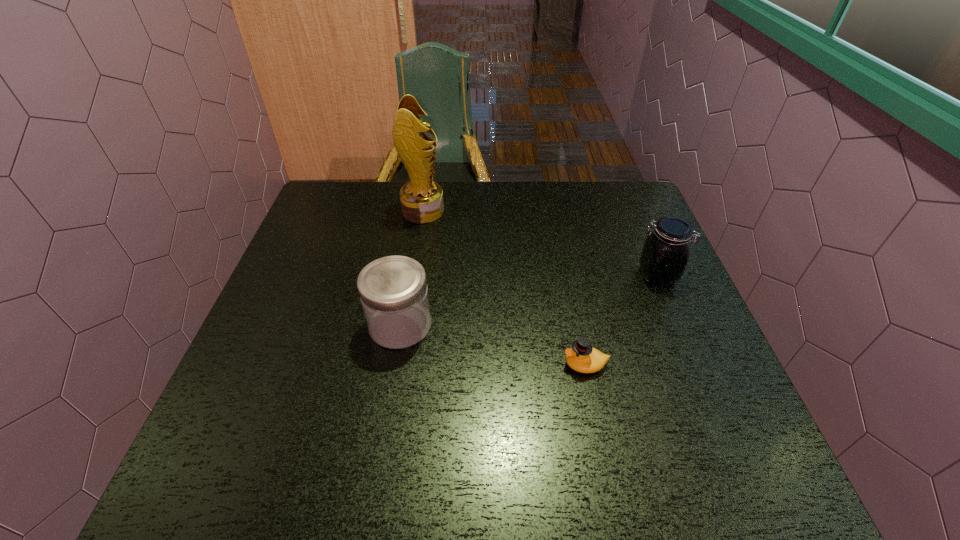
Identify the location of free region located on the lid of the second farthest object. (593, 275).

The height and width of the screenshot is (540, 960). In order to click on free spot located 0.290m on the lid of the second farthest object in this screenshot , I will do `click(524, 275)`.

Find the location of `vacant space located on the left of the left jar`. vacant space located on the left of the left jar is located at coordinates (330, 325).

The width and height of the screenshot is (960, 540). Identify the location of free space located 0.240m on the front-facing side of the second object from right to left. (451, 364).

Locate an element on the screen. vacant space positioned on the front-facing side of the second object from right to left is located at coordinates (497, 364).

What are the coordinates of `free point located 0.120m on the front-facing side of the second object from right to left` in the screenshot? It's located at (507, 364).

At what (x,y) coordinates should I click in order to perform the action: click on object that is positioned at the far edge. Please return your answer as a coordinate pair (x, y). Looking at the image, I should click on (421, 198).

At what (x,y) coordinates should I click in order to perform the action: click on object located in the right edge section of the desktop. Please return your answer as a coordinate pair (x, y). The height and width of the screenshot is (540, 960). Looking at the image, I should click on click(665, 254).

Find the location of `free space at the far edge`. free space at the far edge is located at coordinates (581, 195).

At what (x,y) coordinates should I click in order to perform the action: click on free region at the left edge. Please return your answer as a coordinate pair (x, y). The width and height of the screenshot is (960, 540). Looking at the image, I should click on (257, 376).